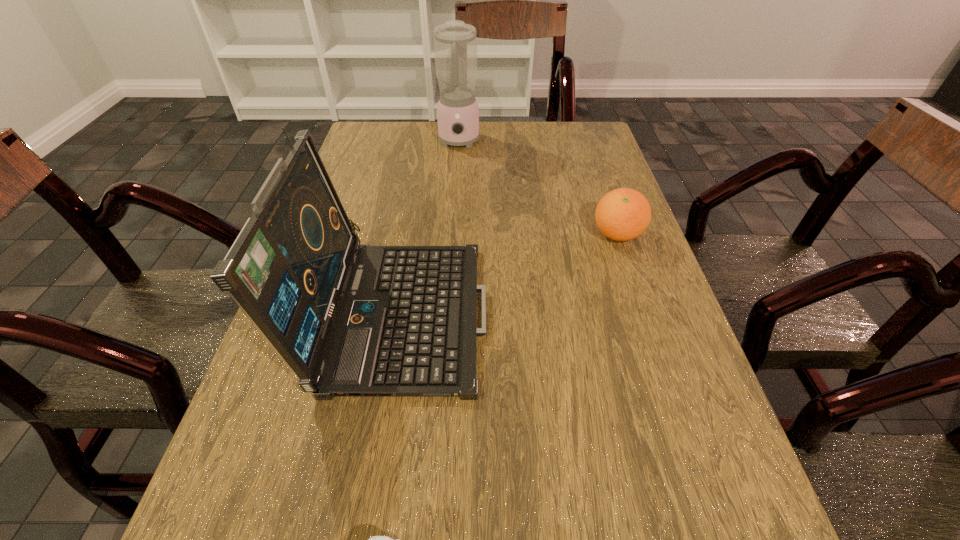
I want to click on free space at the far edge of the desktop, so click(x=513, y=132).

At what (x,y) coordinates should I click in order to perform the action: click on vacant space at the left edge. Please return your answer as a coordinate pair (x, y). This screenshot has width=960, height=540. Looking at the image, I should click on (384, 211).

This screenshot has width=960, height=540. In the image, there is a desktop. Identify the location of vacant space at the right edge. (579, 217).

Find the location of a particular element. The image size is (960, 540). vacant space at the far left corner is located at coordinates (393, 123).

In the image, there is a desktop. At what (x,y) coordinates should I click in order to perform the action: click on free space at the far right corner. Please return your answer as a coordinate pair (x, y). Looking at the image, I should click on (583, 130).

Identify the location of vacant region between the food processor and the rightmost object. (538, 188).

Where is `unoccupied area between the food processor and the third tallest object`? unoccupied area between the food processor and the third tallest object is located at coordinates (538, 188).

Image resolution: width=960 pixels, height=540 pixels. What are the coordinates of `free area in between the orange and the laptop computer` in the screenshot? It's located at (508, 271).

At what (x,y) coordinates should I click in order to perform the action: click on unoccupied area between the laptop computer and the rightmost object. Please return your answer as a coordinate pair (x, y). Image resolution: width=960 pixels, height=540 pixels. Looking at the image, I should click on (508, 271).

Locate an element on the screen. The height and width of the screenshot is (540, 960). vacant point located between the laptop computer and the food processor is located at coordinates (428, 225).